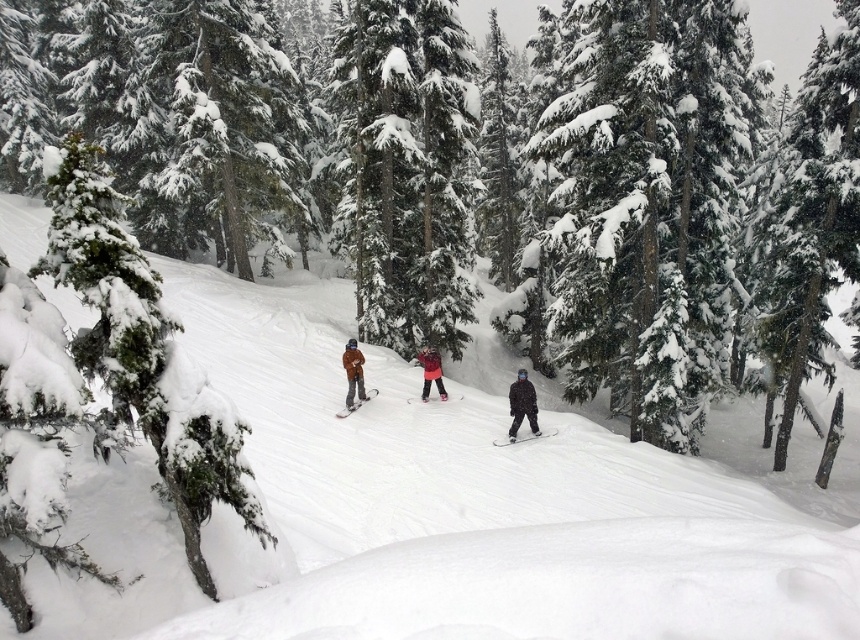
Question: Does white snow ski slope at center have a smaller size compared to matte pink ski at center?

Choices:
 (A) no
 (B) yes

Answer: (A)

Question: Based on their relative distances, which object is nearer to the snow-covered evergreen tree at upper right?

Choices:
 (A) black matte ski at center
 (B) snow-covered evergreen tree at center

Answer: (B)

Question: Which point appears farthest from the camera in this image?

Choices:
 (A) (809, 148)
 (B) (363, 401)
 (C) (502, 442)

Answer: (A)

Question: In this image, where is brown matte snowboarder at center located relative to black matte ski at center?

Choices:
 (A) below
 (B) above

Answer: (B)

Question: Is snow-covered evergreen tree at upper right smaller than matte black snowboard at center?

Choices:
 (A) no
 (B) yes

Answer: (A)

Question: Which object is the closest to the green snow-covered tree at left?

Choices:
 (A) matte pink ski at center
 (B) black matte ski at center
 (C) dark brown snowsuit at center
 (D) brown matte snowboarder at center

Answer: (B)